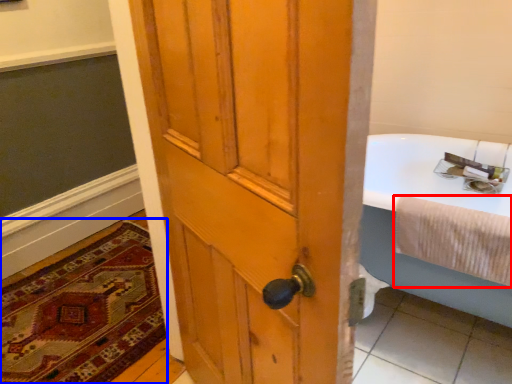
Question: Among these objects, which one is nearest to the camera, bath towel (highlighted by a red box) or mat (highlighted by a blue box)?

Choices:
 (A) bath towel
 (B) mat

Answer: (A)